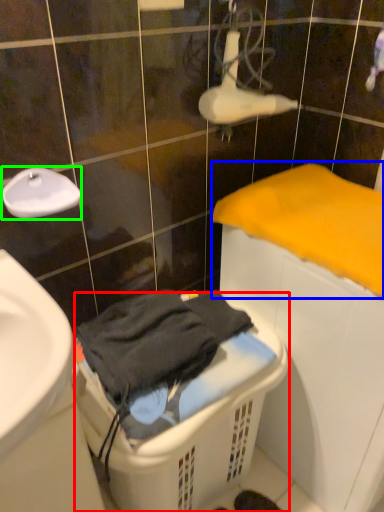
Question: Which object is the closest to the laundry basket (highlighted by a red box)? Choose among these: bath towel (highlighted by a blue box) or faucet (highlighted by a green box).

Choices:
 (A) bath towel
 (B) faucet

Answer: (A)